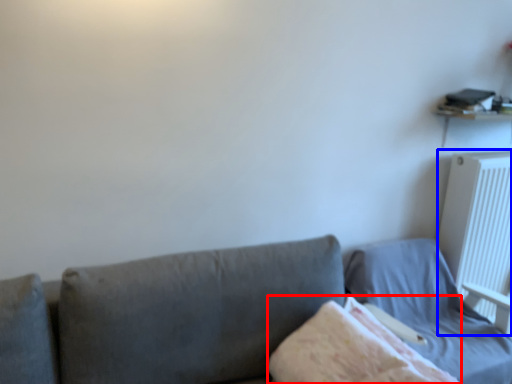
Question: Among these objects, which one is farthest to the camera, blanket (highlighted by a red box) or radiator (highlighted by a blue box)?

Choices:
 (A) blanket
 (B) radiator

Answer: (B)